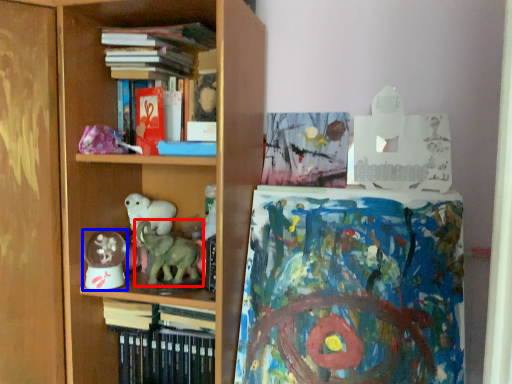
Question: Which of the following is the farthest to the observer, animal (highlighted by a red box) or toy (highlighted by a blue box)?

Choices:
 (A) animal
 (B) toy

Answer: (B)